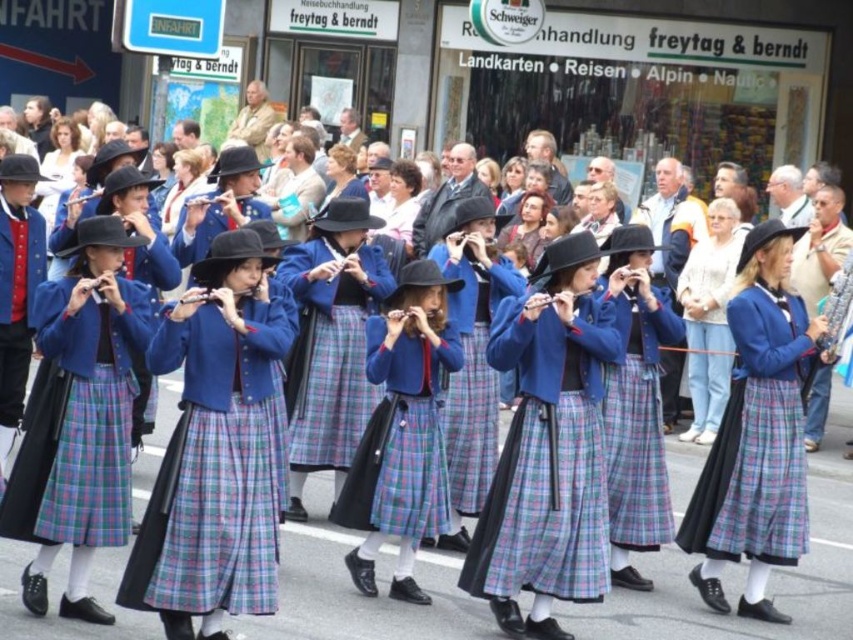
You are a photographer standing in the middle of the street. You want to take a photo that includes both the point at (358,576) and the point at (759,364). Which point should you focus on first to ensure both are in clear view?

You should focus on point (358,576) first because it is closer to you than point (759,364), ensuring both are in focus when you adjust the camera.

You are a photographer positioned at the front of the crowd. You want to take a photo of the Swiss women in their traditional attire without any obstructions. Which object from the following should you ensure is not blocking your view? The options are the matte blue jacket at center and the plaid wool skirt at center.

The matte blue jacket at center is in front of the plaid wool skirt at center, so you should ensure the matte blue jacket at center is not blocking your view.

You are a photographer standing at the edge of the crowd trying to capture a clear shot of the performers. The matte blue jacket at center and the plaid wool skirt at center are both in your view. Which one do you need to focus on first to ensure both are in focus?

The matte blue jacket at center has a greater height compared to plaid wool skirt at center, so you should focus on the matte blue jacket at center first as it is taller and likely closer to the camera.